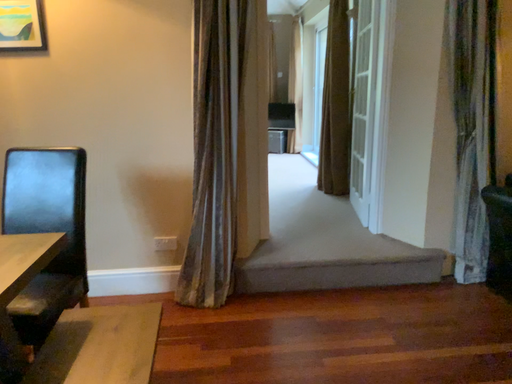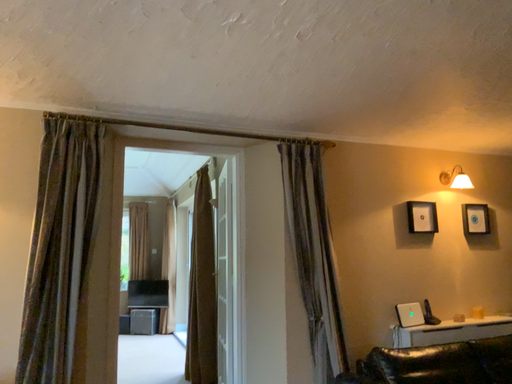
Question: How did the camera likely rotate when shooting the video?

Choices:
 (A) rotated upward
 (B) rotated downward

Answer: (A)